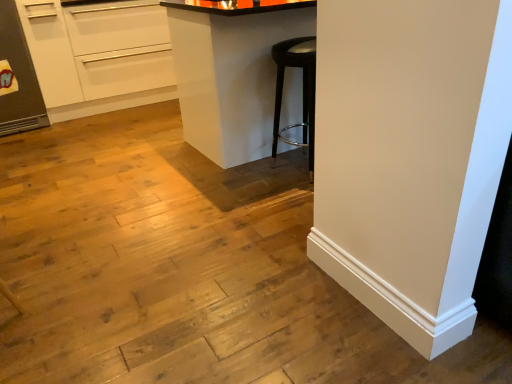
Describe the element at coordinates (231, 74) in the screenshot. I see `white matte cabinet at center` at that location.

Locate an element on the screen. This screenshot has width=512, height=384. white matte cabinet at center is located at coordinates coord(231,74).

In order to click on white matte cabinet at center in this screenshot , I will do `click(231, 74)`.